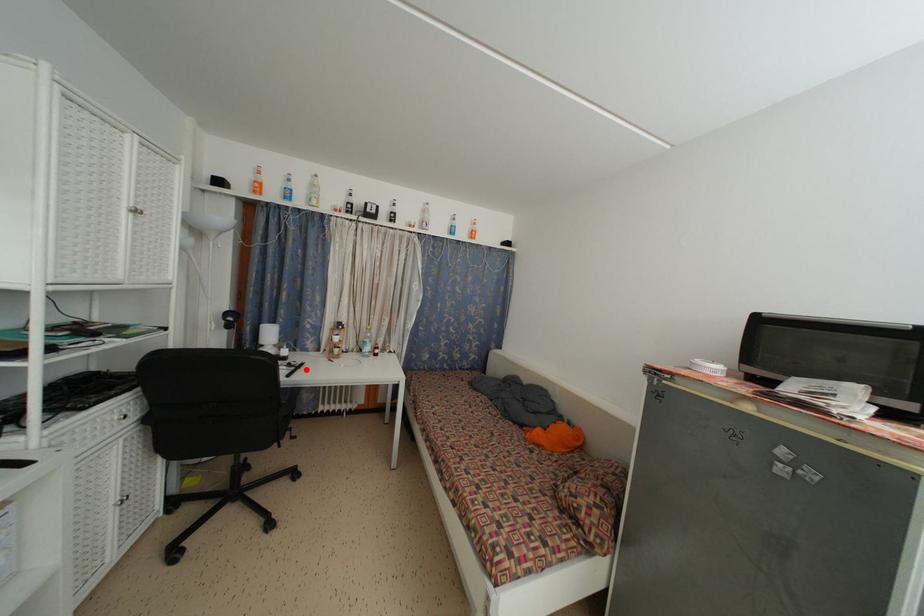
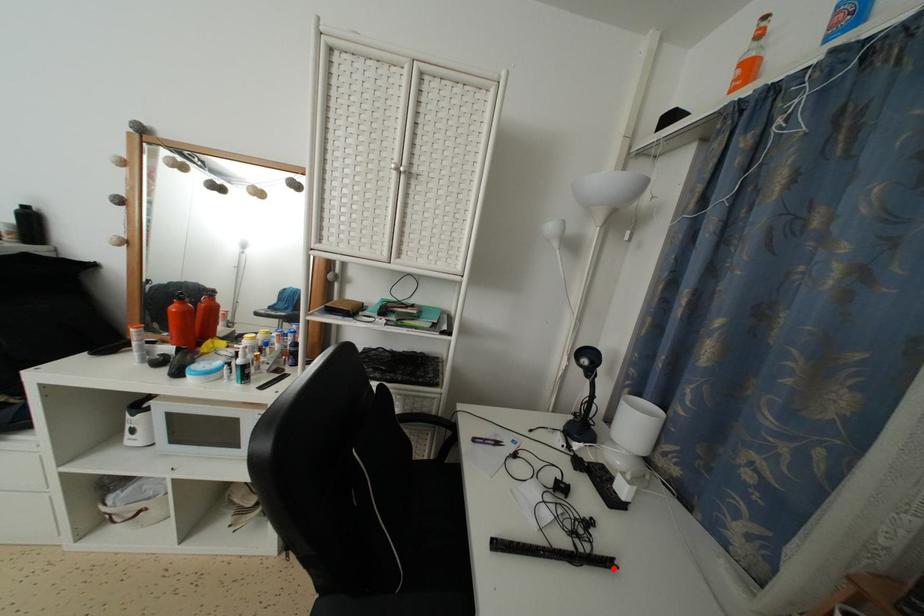
I am providing you with two images of the same scene from different viewpoints. A red point is marked on the first image and another point is marked on the second image. Is the red point in image1 aligned with the point shown in image2?

Yes